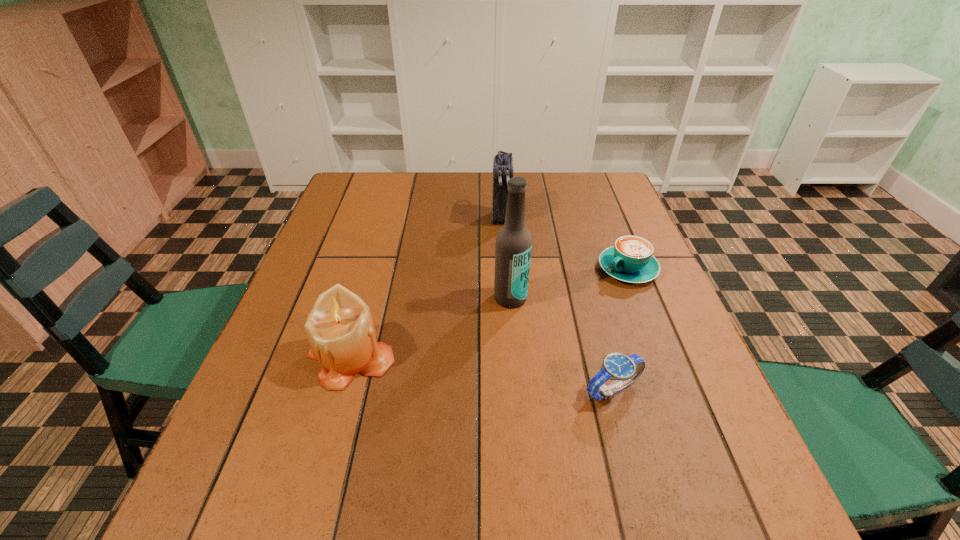
Identify the location of free space between the tallest object and the third shortest object. The image size is (960, 540). (431, 328).

In order to click on free space that is in between the candle and the cappuccino in this screenshot , I will do `click(490, 313)`.

In order to click on free space between the tallest object and the candle in this screenshot , I will do `click(431, 328)`.

Identify the location of vacant area that lies between the leftmost object and the cappuccino. (490, 313).

Where is `vacant region between the leftmost object and the watch`? This screenshot has width=960, height=540. vacant region between the leftmost object and the watch is located at coordinates (482, 374).

Locate an element on the screen. vacant space that is in between the tallest object and the leftmost object is located at coordinates (431, 328).

Locate an element on the screen. free area in between the candle and the cappuccino is located at coordinates (490, 313).

Find the location of a particular element. The height and width of the screenshot is (540, 960). unoccupied position between the tallest object and the cappuccino is located at coordinates (569, 284).

Locate which object is the closest to the farthest object. Please provide its 2D coordinates. Your answer should be formatted as a tuple, i.e. [(x, y)], where the tuple contains the x and y coordinates of a point satisfying the conditions above.

[(631, 259)]

The height and width of the screenshot is (540, 960). In order to click on the closest object relative to the leftmost object in this screenshot , I will do `click(513, 247)`.